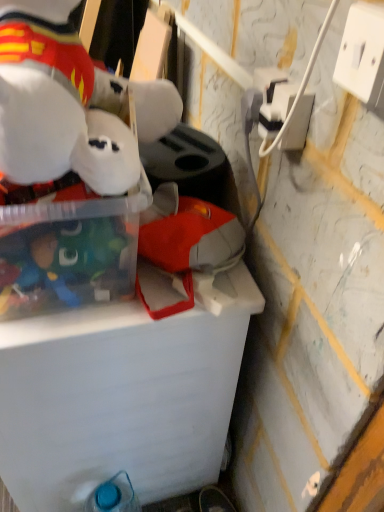
Question: Does white plastic power outlet at upper right, acting as the 2th power outlet starting from the back, have a greater height compared to blue plastic bottle at lower left?

Choices:
 (A) yes
 (B) no

Answer: (B)

Question: Is white plastic power outlet at upper right, arranged as the 1th power outlet when viewed from the front, beside blue plastic bottle at lower left?

Choices:
 (A) no
 (B) yes

Answer: (A)

Question: Can you confirm if white plastic power outlet at upper right, acting as the 2th power outlet starting from the back, is bigger than blue plastic bottle at lower left?

Choices:
 (A) no
 (B) yes

Answer: (A)

Question: Does white plastic power outlet at upper right, which is the first power outlet in right-to-left order, appear on the right side of blue plastic bottle at lower left?

Choices:
 (A) yes
 (B) no

Answer: (A)

Question: Are white plastic power outlet at upper right, acting as the 2th power outlet starting from the back, and blue plastic bottle at lower left far apart?

Choices:
 (A) no
 (B) yes

Answer: (B)

Question: From a real-world perspective, relative to white plastic power outlet at upper right, marked as the second power outlet in a front-to-back arrangement, is blue plastic bottle at lower left vertically above or below?

Choices:
 (A) above
 (B) below

Answer: (B)

Question: Relative to white plastic power outlet at upper right, which is the 1th power outlet from left to right, is blue plastic bottle at lower left in front or behind?

Choices:
 (A) behind
 (B) front

Answer: (A)

Question: Is point (102, 486) positioned closer to the camera than point (307, 100)?

Choices:
 (A) closer
 (B) farther

Answer: (B)

Question: In terms of height, does blue plastic bottle at lower left look taller or shorter compared to white plastic power outlet at upper right, marked as the second power outlet in a front-to-back arrangement?

Choices:
 (A) short
 (B) tall

Answer: (B)

Question: In terms of height, does white plush toy at upper left look taller or shorter compared to white plastic power outlet at upper right, which is the 1th power outlet from left to right?

Choices:
 (A) short
 (B) tall

Answer: (B)

Question: Is point (14, 31) closer or farther from the camera than point (281, 95)?

Choices:
 (A) farther
 (B) closer

Answer: (B)

Question: Is white plush toy at upper left bigger or smaller than white plastic power outlet at upper right, the first power outlet in the back-to-front sequence?

Choices:
 (A) small
 (B) big

Answer: (B)

Question: In terms of width, does white plush toy at upper left look wider or thinner when compared to white plastic power outlet at upper right, marked as the second power outlet in a front-to-back arrangement?

Choices:
 (A) thin
 (B) wide

Answer: (B)

Question: Is transparent plastic storage box at upper left situated inside transparent plastic container at upper left or outside?

Choices:
 (A) inside
 (B) outside

Answer: (B)

Question: Is transparent plastic storage box at upper left wider or thinner than transparent plastic container at upper left?

Choices:
 (A) wide
 (B) thin

Answer: (B)